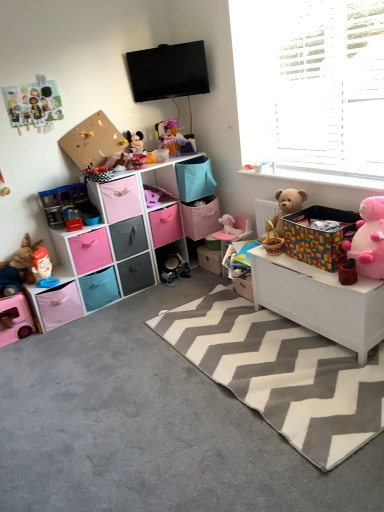
In order to click on free space in front of pink fabric drawer at center, positioned as the second drawer in bottom-to-top order in this screenshot , I will do `click(136, 303)`.